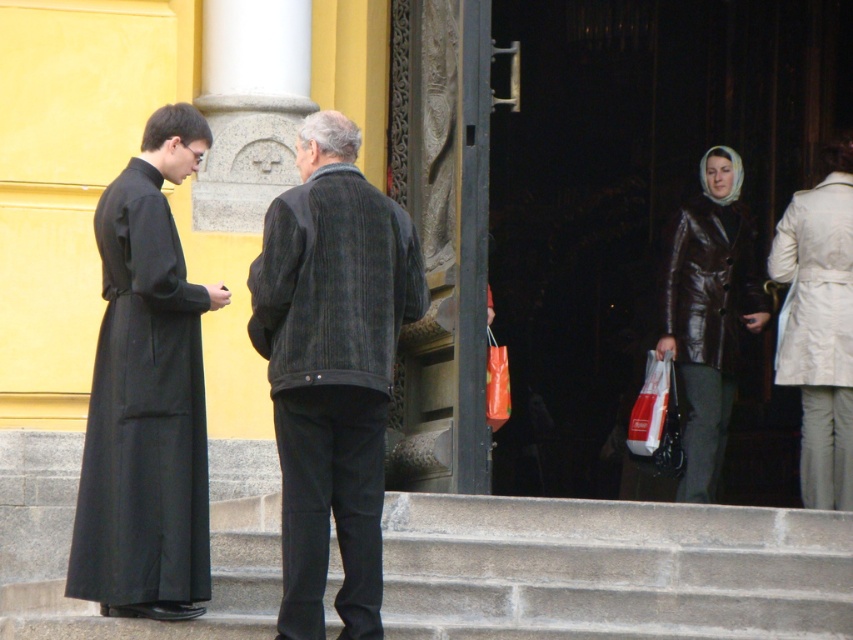
You are a photographer trying to capture a group photo of the dark corduroy jacket at center and the brown leather jacket at right. The camera you are using has a maximum focus range of 15 meters. Will you be able to include both subjects in the same frame without moving closer?

The dark corduroy jacket at center and brown leather jacket at right are 17.10 meters apart, which exceeds the camera maximum focus range of 15 meters. Therefore, you will not be able to include both subjects in the same frame without moving closer.

You are trying to decide which jacket to wear for a casual day out. Based on the image, which jacket is shorter in length between the dark corduroy jacket at center and the brown leather jacket at right?

The dark corduroy jacket at center is shorter in length compared to the brown leather jacket at right.

You are standing at the bottom of the stone steps leading to the church entrance. You need to hand a document to the person wearing the dark gray corduroy jacket at center and the brown leather jacket at right. Which jacket should you approach first based on their positions?

The dark gray corduroy jacket at center is closer to the viewer than the brown leather jacket at right, so you should approach the dark gray corduroy jacket at center first.